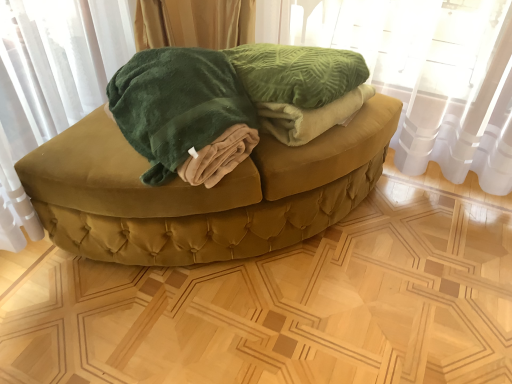
Question: Are green velvet curtain at upper center and velvety green blanket at center making contact?

Choices:
 (A) yes
 (B) no

Answer: (B)

Question: Is green velvet curtain at upper center positioned beyond the bounds of velvety green blanket at center?

Choices:
 (A) yes
 (B) no

Answer: (A)

Question: From the image's perspective, is green velvet curtain at upper center above velvety green blanket at center?

Choices:
 (A) no
 (B) yes

Answer: (B)

Question: Is green velvet curtain at upper center positioned in front of velvety green blanket at center?

Choices:
 (A) yes
 (B) no

Answer: (B)

Question: From a real-world perspective, is green velvet curtain at upper center located higher than velvety green blanket at center?

Choices:
 (A) yes
 (B) no

Answer: (B)

Question: From the image's perspective, is green velvet curtain at upper center below velvety green blanket at center?

Choices:
 (A) no
 (B) yes

Answer: (A)

Question: Could you tell me if green velvet curtain at upper center is turned towards velvet green ottoman at center?

Choices:
 (A) yes
 (B) no

Answer: (B)

Question: Is green velvet curtain at upper center completely or partially outside of velvet green ottoman at center?

Choices:
 (A) yes
 (B) no

Answer: (A)

Question: Does green velvet curtain at upper center have a lesser height compared to velvet green ottoman at center?

Choices:
 (A) yes
 (B) no

Answer: (A)

Question: Considering the relative sizes of green velvet curtain at upper center and velvet green ottoman at center in the image provided, is green velvet curtain at upper center smaller than velvet green ottoman at center?

Choices:
 (A) yes
 (B) no

Answer: (A)

Question: From a real-world perspective, is green velvet curtain at upper center over velvet green ottoman at center?

Choices:
 (A) yes
 (B) no

Answer: (A)

Question: Can you confirm if green velvet curtain at upper center is positioned to the left of velvet green ottoman at center?

Choices:
 (A) yes
 (B) no

Answer: (B)

Question: Can you confirm if velvety green blanket at center is positioned to the right of velvet green ottoman at center?

Choices:
 (A) yes
 (B) no

Answer: (B)